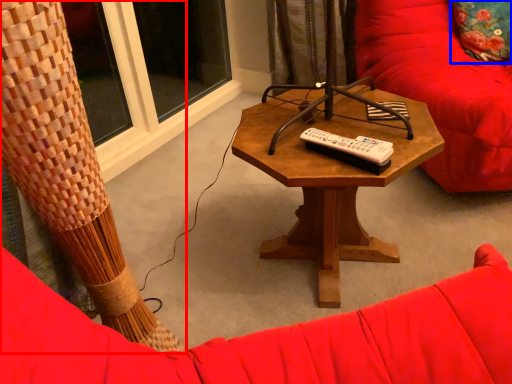
Question: Which object is further to the camera taking this photo, curtain (highlighted by a red box) or throw pillow (highlighted by a blue box)?

Choices:
 (A) curtain
 (B) throw pillow

Answer: (B)